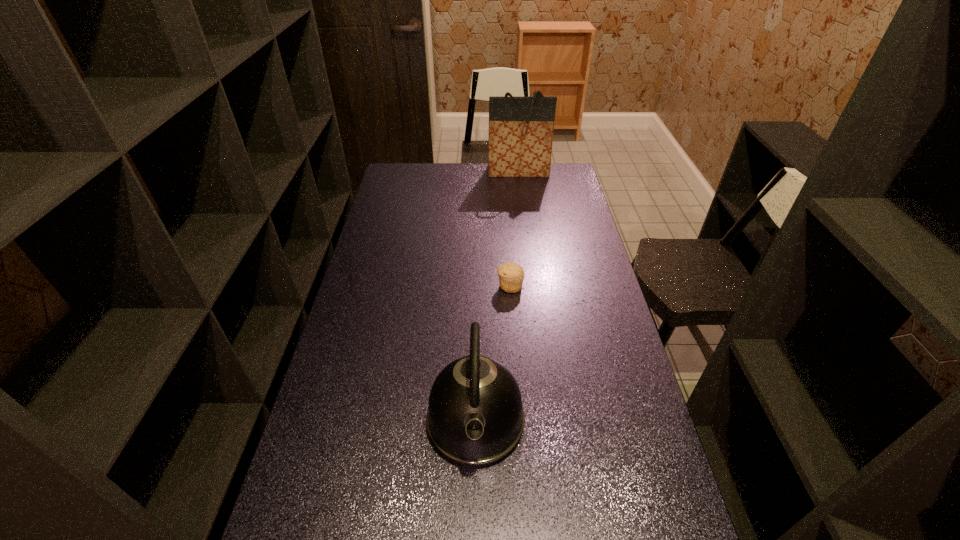
Image resolution: width=960 pixels, height=540 pixels. Find the location of `the farthest object`. the farthest object is located at coordinates (521, 129).

I want to click on shopping bag, so click(x=521, y=129).

Find the location of a particular element. The height and width of the screenshot is (540, 960). the second tallest object is located at coordinates (475, 418).

Where is `the nearest object`? Image resolution: width=960 pixels, height=540 pixels. the nearest object is located at coordinates (475, 418).

Locate an element on the screen. The height and width of the screenshot is (540, 960). muffin is located at coordinates (511, 275).

You are a GUI agent. You are given a task and a screenshot of the screen. Output one action in this format:
    pyautogui.click(x=<x>, y=<y>)
    Task: Click on the second farthest object
    The height and width of the screenshot is (540, 960).
    Given the screenshot: What is the action you would take?
    pyautogui.click(x=511, y=275)

Locate an element on the screen. Image resolution: width=960 pixels, height=540 pixels. free location located on the front-facing side of the farthest object is located at coordinates (521, 196).

Identify the location of free space located 0.080m on the spout of the kettle. (475, 510).

At what (x,y) coordinates should I click in order to perform the action: click on vacant space located 0.360m on the back of the second farthest object. Please return your answer as a coordinate pair (x, y). Looking at the image, I should click on (505, 220).

Find the location of a particular element. object that is positioned at the far edge is located at coordinates (521, 129).